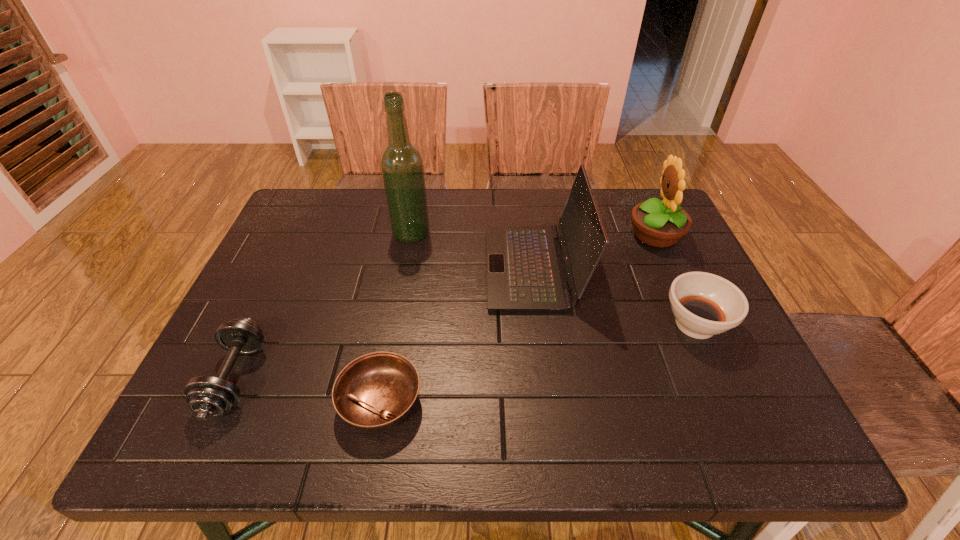
Find the location of a particular element. The width and height of the screenshot is (960, 540). liquor is located at coordinates (402, 168).

Identify the location of sunflower. 659,224.

At what (x,y) coordinates should I click in order to perform the action: click on laptop computer. Please return your answer as a coordinate pair (x, y). The height and width of the screenshot is (540, 960). Looking at the image, I should click on (525, 269).

Where is `dumbbell`? The image size is (960, 540). dumbbell is located at coordinates (207, 396).

Locate an element on the screen. The width and height of the screenshot is (960, 540). the taller soup bowl is located at coordinates (704, 304).

The image size is (960, 540). What are the coordinates of `the farther soup bowl` in the screenshot? It's located at (704, 304).

The image size is (960, 540). Identify the location of the left soup bowl. (375, 392).

Where is `the shortest object`? the shortest object is located at coordinates (375, 392).

Locate an element on the screen. vacant space positioned 0.400m on the right of the tallest object is located at coordinates (571, 233).

This screenshot has height=540, width=960. Find the location of `free point located 0.100m on the face of the sunflower`. free point located 0.100m on the face of the sunflower is located at coordinates (592, 235).